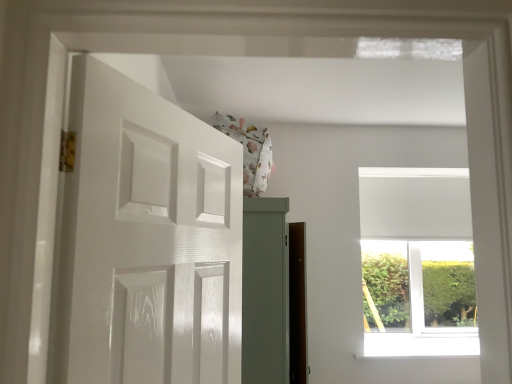
Describe the element at coordinates (417, 262) in the screenshot. I see `white matte window at upper right` at that location.

Measure the distance between white glossy door at left and camera.

white glossy door at left is 29.06 inches from camera.

The width and height of the screenshot is (512, 384). Describe the element at coordinates (422, 343) in the screenshot. I see `white smooth window sill at upper center` at that location.

Image resolution: width=512 pixels, height=384 pixels. In order to click on white matte window at upper right in this screenshot , I will do `click(417, 262)`.

Considering the positions of points (378, 348) and (403, 216), is point (378, 348) farther from camera compared to point (403, 216)?

No, (378, 348) is closer to viewer.

Would you say white smooth window sill at upper center is inside or outside white matte window at upper right?

white smooth window sill at upper center is not inside white matte window at upper right, it's outside.

Is white smooth window sill at upper center further to the viewer compared to white matte window at upper right?

No, it is not.

Are white smooth window sill at upper center and white matte window at upper right located far from each other?

They are positioned close to each other.

Locate an element on the screen. Image resolution: width=512 pixels, height=384 pixels. door on the left of white smooth window sill at upper center is located at coordinates (147, 240).

Between point (413, 343) and point (115, 184), which one is positioned behind?

Point (413, 343)

Can you tell me how much white smooth window sill at upper center and white glossy door at left differ in facing direction?

67.2 degrees.

Based on their sizes in the image, would you say white smooth window sill at upper center is bigger or smaller than white glossy door at left?

Considering their sizes, white smooth window sill at upper center takes up less space than white glossy door at left.

Which object is closer to the camera, white matte window at upper right or white smooth window sill at upper center?

white smooth window sill at upper center is in front.

Does point (429, 284) lie in front of point (412, 338)?

No, (429, 284) is behind (412, 338).

There is a white smooth window sill at upper center. Where is `window above it (from a real-world perspective)`? This screenshot has height=384, width=512. window above it (from a real-world perspective) is located at coordinates (417, 262).

Looking at this image, is white matte window at upper right spatially inside white smooth window sill at upper center, or outside of it?

white matte window at upper right is not inside white smooth window sill at upper center, it's outside.

Can you confirm if white matte window at upper right is bigger than white glossy door at left?

Yes, white matte window at upper right is bigger than white glossy door at left.

Is white matte window at upper right aimed at white glossy door at left?

No, white matte window at upper right is not aimed at white glossy door at left.

From the image's perspective, is white matte window at upper right beneath white glossy door at left?

Indeed, from the image's perspective, white matte window at upper right is shown beneath white glossy door at left.

Is white matte window at upper right touching white glossy door at left?

They are not placed beside each other.

From the image's perspective, is white glossy door at left over white smooth window sill at upper center?

Yes, from the image's perspective, white glossy door at left is above white smooth window sill at upper center.

Identify the location of door located above the white smooth window sill at upper center (from the image's perspective). (147, 240).

Is white glossy door at left wider or thinner than white smooth window sill at upper center?

white glossy door at left is thinner than white smooth window sill at upper center.

Who is shorter, white glossy door at left or white matte window at upper right?

white glossy door at left is shorter.

Can you confirm if white glossy door at left is positioned to the right of white matte window at upper right?

In fact, white glossy door at left is to the left of white matte window at upper right.

Which point is more distant from viewer, (71, 227) or (471, 342)?

Positioned behind is point (471, 342).

Is white glossy door at left next to white matte window at upper right?

No.

This screenshot has height=384, width=512. What are the coordinates of `window lying on the right of white smooth window sill at upper center` in the screenshot? It's located at (417, 262).

Find the location of `door lying above the white smooth window sill at upper center (from the image's perspective)`. door lying above the white smooth window sill at upper center (from the image's perspective) is located at coordinates click(x=147, y=240).

Based on their spatial positions, is white matte window at upper right or white glossy door at left further from white smooth window sill at upper center?

Among the two, white glossy door at left is located further to white smooth window sill at upper center.

Estimate the real-world distances between objects in this image. Which object is closer to white glossy door at left, white smooth window sill at upper center or white matte window at upper right?

white smooth window sill at upper center is closer to white glossy door at left.

Considering their positions, is white matte window at upper right positioned closer to white glossy door at left than white smooth window sill at upper center?

white smooth window sill at upper center lies closer to white glossy door at left than the other object.

Which object lies further to the anchor point white matte window at upper right, white smooth window sill at upper center or white glossy door at left?

Based on the image, white glossy door at left appears to be further to white matte window at upper right.

Consider the image. Based on their spatial positions, is white glossy door at left or white matte window at upper right further from white smooth window sill at upper center?

Among the two, white glossy door at left is located further to white smooth window sill at upper center.

Considering their positions, is white glossy door at left positioned further to white matte window at upper right than white smooth window sill at upper center?

white glossy door at left lies further to white matte window at upper right than the other object.

This screenshot has height=384, width=512. I want to click on window sill between white glossy door at left and white matte window at upper right in the front-back direction, so click(422, 343).